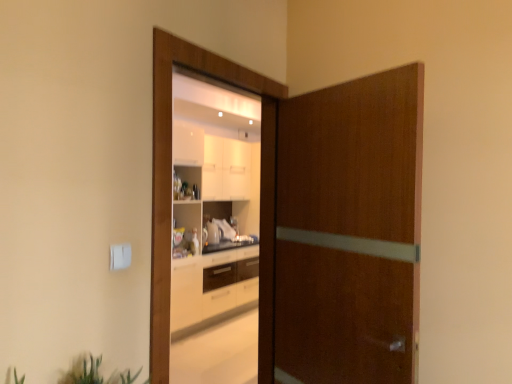
Question: Does wooden door at center, which is the 2th screen door in right-to-left order, appear on the right side of brown wood door at center, the first screen door positioned from the right?

Choices:
 (A) no
 (B) yes

Answer: (A)

Question: From the image's perspective, is wooden door at center, which is the 2th screen door in right-to-left order, beneath brown wood door at center, the first screen door positioned from the right?

Choices:
 (A) no
 (B) yes

Answer: (A)

Question: Is wooden door at center, which is the 2th screen door in right-to-left order, bigger than brown wood door at center, the 2th screen door viewed from the left?

Choices:
 (A) yes
 (B) no

Answer: (B)

Question: Is wooden door at center, which is the 2th screen door in right-to-left order, thinner than brown wood door at center, the 2th screen door viewed from the left?

Choices:
 (A) no
 (B) yes

Answer: (B)

Question: Are wooden door at center, marked as the 1th screen door in a left-to-right arrangement, and brown wood door at center, the 2th screen door viewed from the left, located far from each other?

Choices:
 (A) yes
 (B) no

Answer: (B)

Question: Considering the relative sizes of wooden door at center, marked as the 1th screen door in a left-to-right arrangement, and brown wood door at center, the first screen door positioned from the right, in the image provided, is wooden door at center, marked as the 1th screen door in a left-to-right arrangement, shorter than brown wood door at center, the first screen door positioned from the right,?

Choices:
 (A) yes
 (B) no

Answer: (B)

Question: From a real-world perspective, is green leafy plant at lower left over brown wood door at center, the first screen door positioned from the right?

Choices:
 (A) yes
 (B) no

Answer: (B)

Question: Is green leafy plant at lower left further to camera compared to brown wood door at center, the 2th screen door viewed from the left?

Choices:
 (A) yes
 (B) no

Answer: (B)

Question: Considering the relative sizes of green leafy plant at lower left and brown wood door at center, the first screen door positioned from the right, in the image provided, is green leafy plant at lower left shorter than brown wood door at center, the first screen door positioned from the right,?

Choices:
 (A) no
 (B) yes

Answer: (B)

Question: Does green leafy plant at lower left have a larger size compared to brown wood door at center, the 2th screen door viewed from the left?

Choices:
 (A) yes
 (B) no

Answer: (B)

Question: Does green leafy plant at lower left contain brown wood door at center, the 2th screen door viewed from the left?

Choices:
 (A) no
 (B) yes

Answer: (A)

Question: Considering the relative sizes of green leafy plant at lower left and brown wood door at center, the first screen door positioned from the right, in the image provided, is green leafy plant at lower left wider than brown wood door at center, the first screen door positioned from the right,?

Choices:
 (A) yes
 (B) no

Answer: (A)

Question: From the image's perspective, does wooden door at center, which is the 2th screen door in right-to-left order, appear higher than green leafy plant at lower left?

Choices:
 (A) no
 (B) yes

Answer: (B)